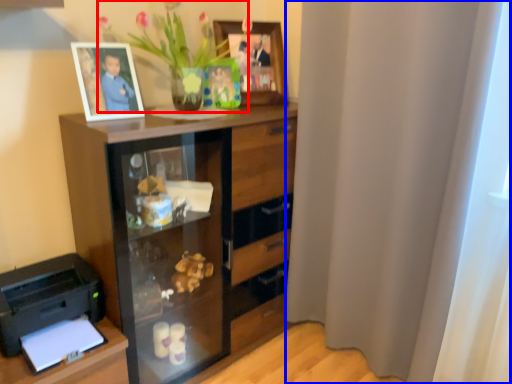
Question: Which of the following is the farthest to the observer, floral arrangement (highlighted by a red box) or curtain (highlighted by a blue box)?

Choices:
 (A) floral arrangement
 (B) curtain

Answer: (A)